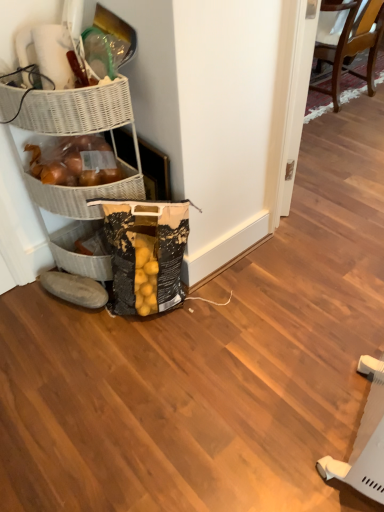
Question: Considering the relative positions of black textured grocery bag at lower left and wooden chair at upper right in the image provided, is black textured grocery bag at lower left to the left or to the right of wooden chair at upper right?

Choices:
 (A) left
 (B) right

Answer: (A)

Question: Which is correct: black textured grocery bag at lower left is inside wooden chair at upper right, or outside of it?

Choices:
 (A) inside
 (B) outside

Answer: (B)

Question: Which object is the closest to the wooden chair at upper right?

Choices:
 (A) black textured grocery bag at lower left
 (B) white wicker basket at upper left
 (C) gray fabric slipper at lower left

Answer: (A)

Question: Based on their relative distances, which object is nearer to the gray fabric slipper at lower left?

Choices:
 (A) black textured grocery bag at lower left
 (B) wooden chair at upper right
 (C) white wicker basket at upper left

Answer: (A)